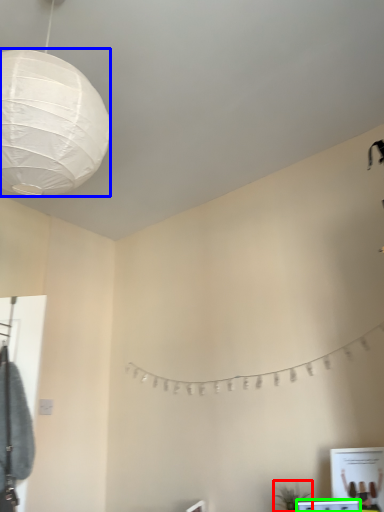
Question: Which is farther away from plant (highlighted by a red box)? lantern (highlighted by a blue box) or vanity (highlighted by a green box)?

Choices:
 (A) lantern
 (B) vanity

Answer: (A)